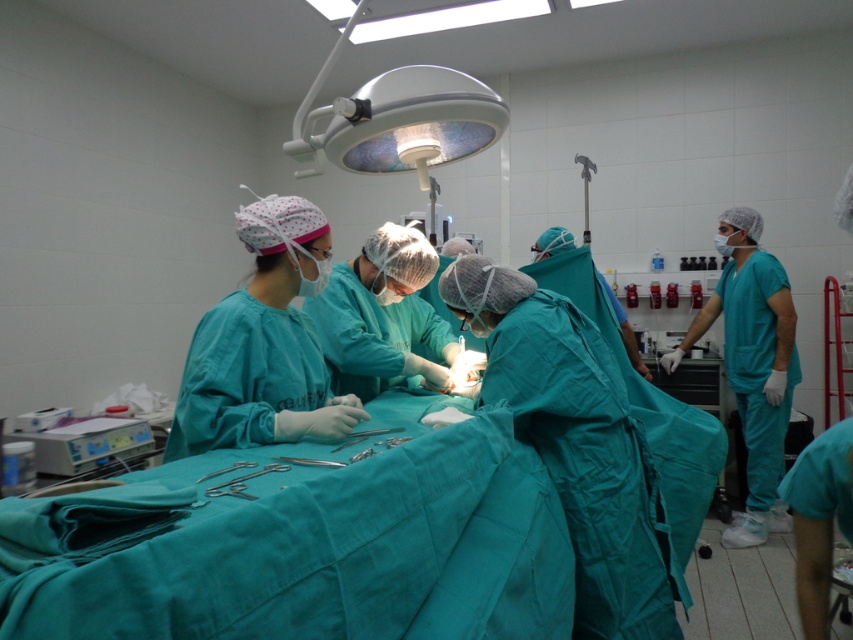
Is matte green gown at center further to camera compared to metallic silver scissors at center?

That is True.

Does matte green gown at center appear under metallic silver scissors at center?

Actually, matte green gown at center is above metallic silver scissors at center.

Measure the distance between matte green gown at center and camera.

matte green gown at center is 7.08 feet from camera.

Locate an element on the screen. The image size is (853, 640). matte green gown at center is located at coordinates (381, 317).

Does point (775, 372) lie in front of point (250, 496)?

No, (775, 372) is further to viewer.

Does teal matte scrubs at right have a larger size compared to metallic silver scissors at center?

Yes, teal matte scrubs at right is bigger than metallic silver scissors at center.

Is point (767, 531) positioned in front of point (221, 486)?

No, it is not.

Where is `teal matte scrubs at right`? teal matte scrubs at right is located at coordinates (752, 365).

In the scene shown: Does matte green gown at center appear on the left side of metallic silver medical device at lower left?

Incorrect, matte green gown at center is not on the left side of metallic silver medical device at lower left.

Can you confirm if matte green gown at center is bigger than metallic silver medical device at lower left?

Indeed, matte green gown at center has a larger size compared to metallic silver medical device at lower left.

Where is `matte green gown at center`? matte green gown at center is located at coordinates (381, 317).

At what (x,y) coordinates should I click in order to perform the action: click on matte green gown at center. Please return your answer as a coordinate pair (x, y). Looking at the image, I should click on (381, 317).